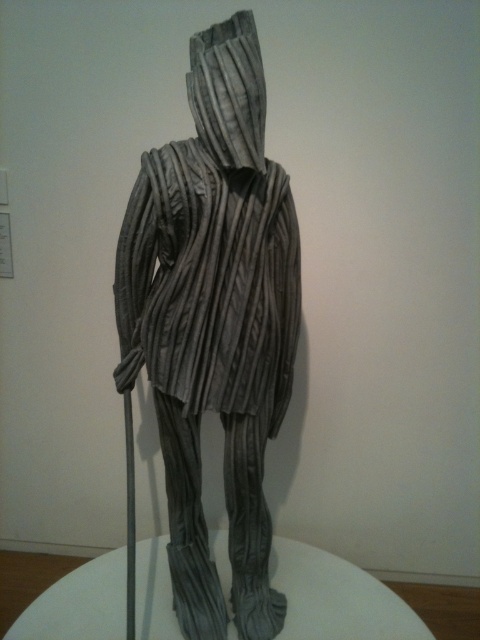
Question: Can you confirm if white glossy glass table at center is thinner than gray textured fabric hood at center?

Choices:
 (A) no
 (B) yes

Answer: (A)

Question: Based on their relative distances, which object is farther from the gray pleated fabric at center?

Choices:
 (A) white glossy glass table at center
 (B) gray textured fabric hood at center

Answer: (A)

Question: Can you confirm if white glossy glass table at center is positioned above gray textured fabric hood at center?

Choices:
 (A) yes
 (B) no

Answer: (B)

Question: Estimate the real-world distances between objects in this image. Which object is farther from the gray pleated fabric at center?

Choices:
 (A) smooth gray pole at center
 (B) gray textured fabric hood at center

Answer: (A)

Question: Does white glossy glass table at center have a smaller size compared to gray textured fabric hood at center?

Choices:
 (A) no
 (B) yes

Answer: (A)

Question: Which object is positioned farthest from the white glossy glass table at center?

Choices:
 (A) gray pleated fabric at center
 (B) gray textured fabric hood at center
 (C) smooth gray pole at center

Answer: (B)